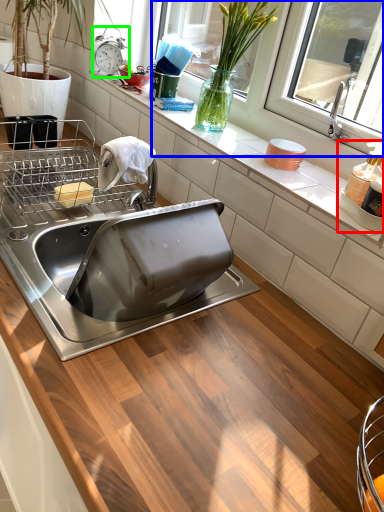
Question: Considering the real-world distances, which object is farthest from appliance (highlighted by a red box)? window screen (highlighted by a blue box) or alarm clock (highlighted by a green box)?

Choices:
 (A) window screen
 (B) alarm clock

Answer: (B)